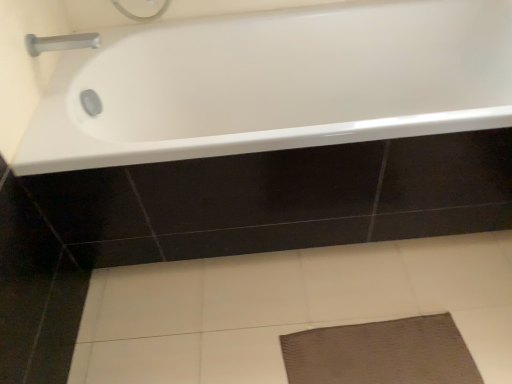
Image resolution: width=512 pixels, height=384 pixels. Describe the element at coordinates (61, 42) in the screenshot. I see `silver metallic tap at upper left` at that location.

Identify the location of silver metallic tap at upper left. The image size is (512, 384). (61, 42).

Describe the element at coordinates (276, 84) in the screenshot. I see `white glossy bathtub at upper center` at that location.

You are a GUI agent. You are given a task and a screenshot of the screen. Output one action in this format:
    pyautogui.click(x=<x>, y=<y>)
    Task: Click on the white glossy bathtub at upper center
    The image size is (512, 384).
    Given the screenshot: What is the action you would take?
    pyautogui.click(x=276, y=84)

The width and height of the screenshot is (512, 384). In order to click on silver metallic tap at upper left in this screenshot , I will do `click(61, 42)`.

In the image, is silver metallic tap at upper left on the left side or the right side of white glossy bathtub at upper center?

silver metallic tap at upper left is positioned on white glossy bathtub at upper center's left side.

Is the position of silver metallic tap at upper left less distant than that of white glossy bathtub at upper center?

No, silver metallic tap at upper left is behind white glossy bathtub at upper center.

Is point (69, 36) closer or farther from the camera than point (451, 94)?

Clearly, point (69, 36) is closer to the camera than point (451, 94).

From the image's perspective, does silver metallic tap at upper left appear higher than white glossy bathtub at upper center?

Yes.

From a real-world perspective, is silver metallic tap at upper left physically below white glossy bathtub at upper center?

No, from a real-world perspective, silver metallic tap at upper left is not under white glossy bathtub at upper center.

Considering the sizes of objects silver metallic tap at upper left and white glossy bathtub at upper center in the image provided, who is wider, silver metallic tap at upper left or white glossy bathtub at upper center?

white glossy bathtub at upper center.

Considering the relative sizes of silver metallic tap at upper left and white glossy bathtub at upper center in the image provided, is silver metallic tap at upper left taller than white glossy bathtub at upper center?

No, silver metallic tap at upper left is not taller than white glossy bathtub at upper center.

Who is bigger, silver metallic tap at upper left or white glossy bathtub at upper center?

white glossy bathtub at upper center.

Is silver metallic tap at upper left spatially inside white glossy bathtub at upper center, or outside of it?

silver metallic tap at upper left lies outside white glossy bathtub at upper center.

Is silver metallic tap at upper left far from white glossy bathtub at upper center?

silver metallic tap at upper left is actually quite close to white glossy bathtub at upper center.

Is silver metallic tap at upper left facing away from white glossy bathtub at upper center?

silver metallic tap at upper left is not turned away from white glossy bathtub at upper center.

I want to click on bathtub beneath the silver metallic tap at upper left (from a real-world perspective), so click(x=276, y=84).

In the scene shown: Based on their positions, is white glossy bathtub at upper center located to the left or right of silver metallic tap at upper left?

Based on their positions, white glossy bathtub at upper center is located to the right of silver metallic tap at upper left.

Which object is closer to the camera, white glossy bathtub at upper center or silver metallic tap at upper left?

white glossy bathtub at upper center.

Does point (374, 79) come closer to viewer compared to point (91, 33)?

No, it is not.

From the image's perspective, is white glossy bathtub at upper center below silver metallic tap at upper left?

Indeed, from the image's perspective, white glossy bathtub at upper center is shown beneath silver metallic tap at upper left.

From a real-world perspective, is white glossy bathtub at upper center positioned under silver metallic tap at upper left based on gravity?

Yes, from a real-world perspective, white glossy bathtub at upper center is beneath silver metallic tap at upper left.

Is white glossy bathtub at upper center thinner than silver metallic tap at upper left?

In fact, white glossy bathtub at upper center might be wider than silver metallic tap at upper left.

Consider the image. Considering the sizes of white glossy bathtub at upper center and silver metallic tap at upper left in the image, is white glossy bathtub at upper center taller or shorter than silver metallic tap at upper left?

white glossy bathtub at upper center is taller than silver metallic tap at upper left.

Which of these two, white glossy bathtub at upper center or silver metallic tap at upper left, is bigger?

A: Bigger between the two is white glossy bathtub at upper center.

Is white glossy bathtub at upper center not within silver metallic tap at upper left?

Indeed, white glossy bathtub at upper center is completely outside silver metallic tap at upper left.

Is white glossy bathtub at upper center next to silver metallic tap at upper left?

They are not placed beside each other.

Is white glossy bathtub at upper center oriented towards silver metallic tap at upper left?

No, white glossy bathtub at upper center is not turned towards silver metallic tap at upper left.

At what (x,y) coordinates should I click in order to perform the action: click on bathtub that is under the silver metallic tap at upper left (from a real-world perspective). Please return your answer as a coordinate pair (x, y). Looking at the image, I should click on (276, 84).

Where is `bathtub below the silver metallic tap at upper left (from a real-world perspective)`? This screenshot has height=384, width=512. bathtub below the silver metallic tap at upper left (from a real-world perspective) is located at coordinates (276, 84).

The height and width of the screenshot is (384, 512). In the image, there is a white glossy bathtub at upper center. In order to click on tap above it (from the image's perspective) in this screenshot , I will do `click(61, 42)`.